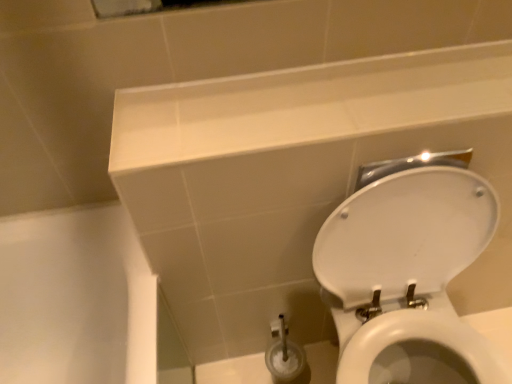
Question: Considering the relative positions of white glossy ledge at upper center and white glossy toilet at lower right in the image provided, is white glossy ledge at upper center to the left or to the right of white glossy toilet at lower right?

Choices:
 (A) left
 (B) right

Answer: (A)

Question: From a real-world perspective, is white glossy ledge at upper center positioned above or below white glossy toilet at lower right?

Choices:
 (A) below
 (B) above

Answer: (B)

Question: In the image, is white glossy ledge at upper center positioned in front of or behind white glossy toilet at lower right?

Choices:
 (A) behind
 (B) front

Answer: (A)

Question: From the image's perspective, is white glossy toilet at lower right positioned above or below white glossy ledge at upper center?

Choices:
 (A) below
 (B) above

Answer: (A)

Question: From a real-world perspective, is white glossy toilet at lower right physically located above or below white glossy ledge at upper center?

Choices:
 (A) below
 (B) above

Answer: (A)

Question: Based on their positions, is white glossy toilet at lower right located to the left or right of white glossy ledge at upper center?

Choices:
 (A) right
 (B) left

Answer: (A)

Question: In the image, is white glossy toilet at lower right positioned in front of or behind white glossy ledge at upper center?

Choices:
 (A) front
 (B) behind

Answer: (A)